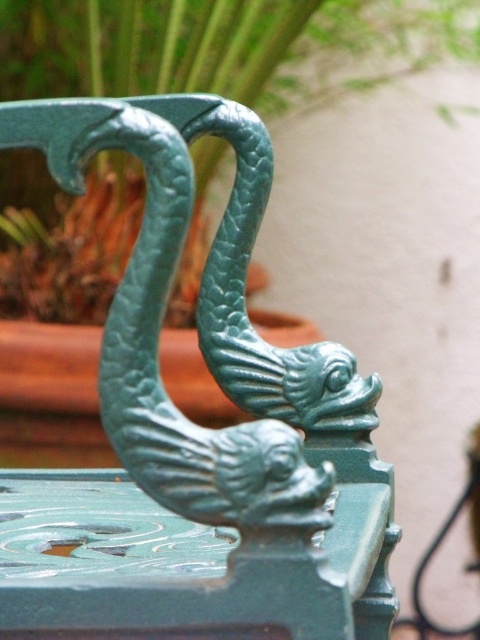
Consider the image. Does green cast iron dragon at center have a greater height compared to green textured plant at upper center?

Incorrect, green cast iron dragon at center's height is not larger of green textured plant at upper center's.

Which is in front, point (126, 332) or point (152, 67)?

Positioned in front is point (126, 332).

Where is `green cast iron dragon at center`? The image size is (480, 640). green cast iron dragon at center is located at coordinates (223, 346).

Locate an element on the screen. The height and width of the screenshot is (640, 480). green cast iron dragon at center is located at coordinates (223, 346).